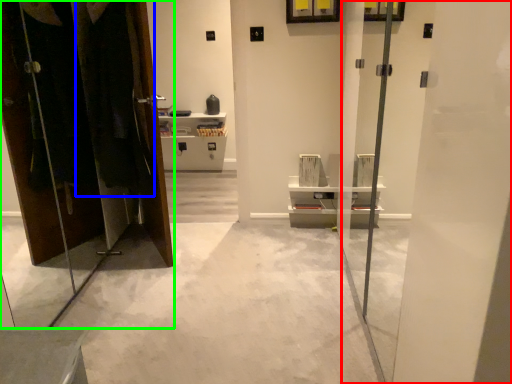
Question: Which object is positioned closest to screen door (highlighted by a red box)? Select from laundry (highlighted by a blue box) and dresser (highlighted by a green box).

Choices:
 (A) laundry
 (B) dresser

Answer: (A)